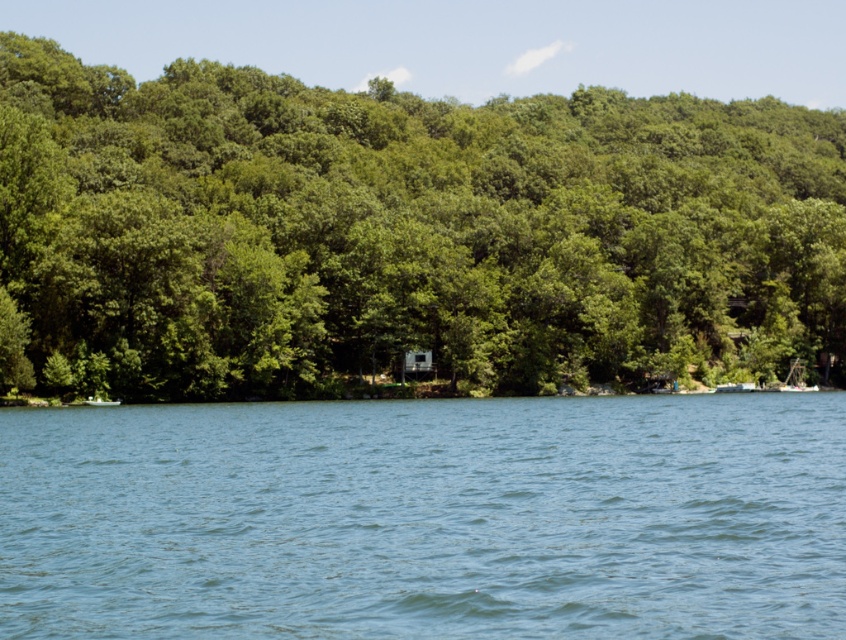
Question: Is green leafy tree at center bigger than blue liquid water at center?

Choices:
 (A) no
 (B) yes

Answer: (B)

Question: Is green leafy tree at center above blue liquid water at center?

Choices:
 (A) no
 (B) yes

Answer: (B)

Question: Is green leafy tree at center bigger than blue liquid water at center?

Choices:
 (A) no
 (B) yes

Answer: (B)

Question: Which of the following is the farthest from the observer?

Choices:
 (A) blue liquid water at center
 (B) green leafy tree at center

Answer: (B)

Question: Which point is closer to the camera taking this photo?

Choices:
 (A) (787, 340)
 (B) (364, 580)

Answer: (B)